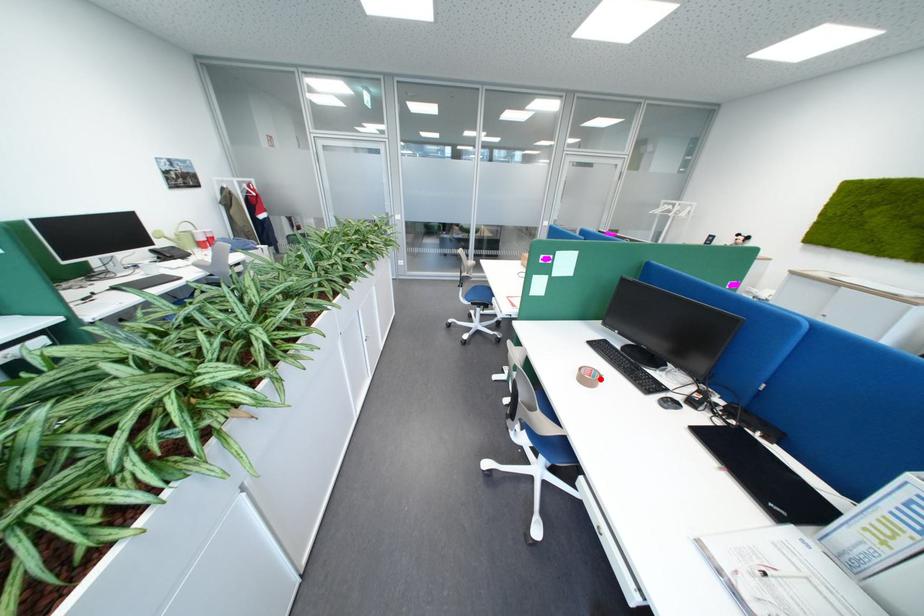
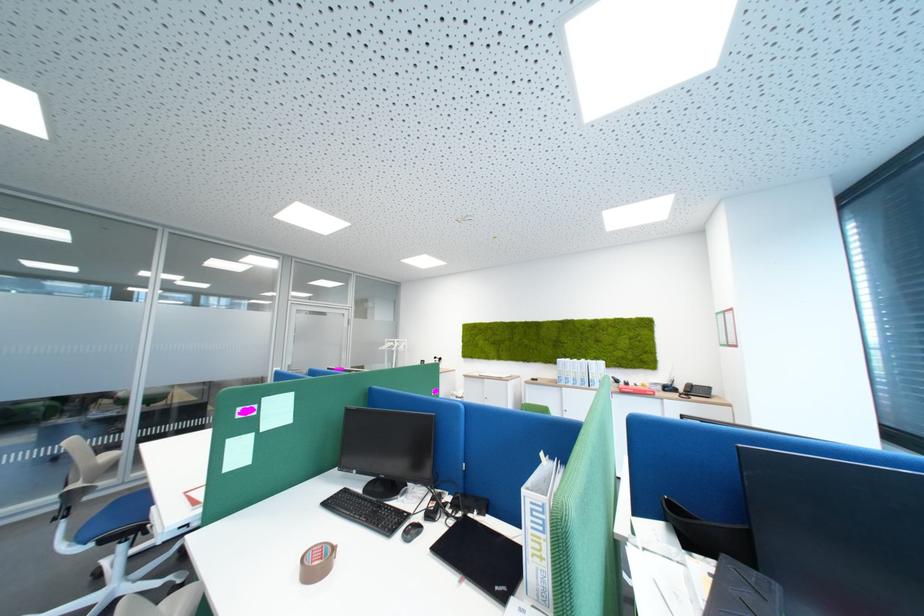
Question: I am providing you with two images of the same scene from different viewpoints. A red point is marked on the first image. Is the red point's position out of view in image 2?

Choices:
 (A) Yes
 (B) No

Answer: (B)